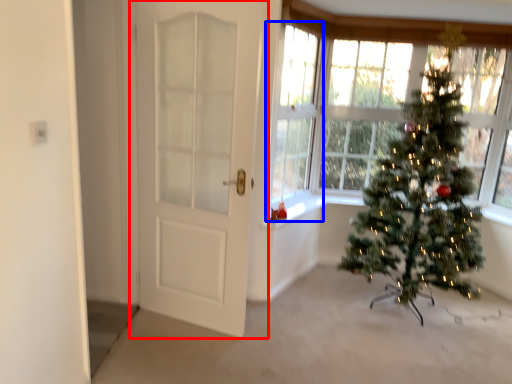
Question: Which point is further to the camera, door (highlighted by a red box) or window (highlighted by a blue box)?

Choices:
 (A) door
 (B) window

Answer: (B)